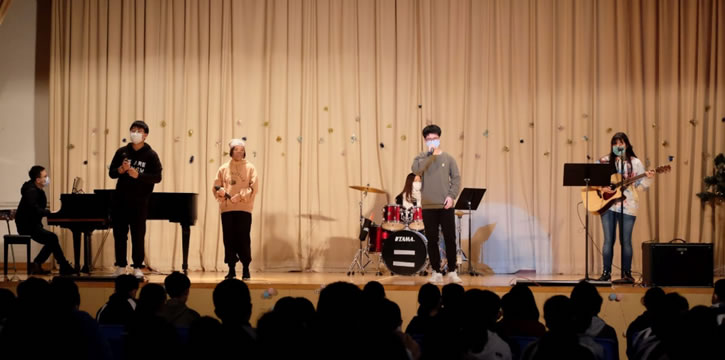
Locate an element on the screen. spotlight is located at coordinates (549, 265), (528, 218), (481, 205), (501, 273), (508, 231).